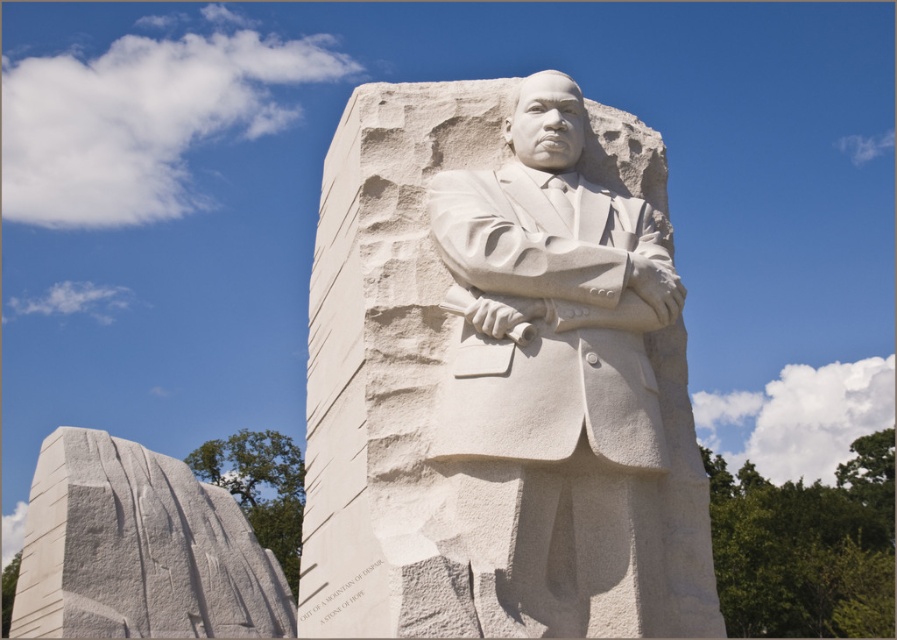
Question: Which point appears farthest from the camera in this image?

Choices:
 (A) (247, 548)
 (B) (601, 300)

Answer: (A)

Question: Which object is closer to the camera taking this photo?

Choices:
 (A) white marble stone at left
 (B) white marble statue at center

Answer: (B)

Question: Can you confirm if white marble statue at center is positioned to the right of white marble stone at left?

Choices:
 (A) no
 (B) yes

Answer: (B)

Question: Is white marble statue at center below white marble stone at left?

Choices:
 (A) no
 (B) yes

Answer: (A)

Question: Does white marble statue at center appear on the right side of white marble stone at left?

Choices:
 (A) no
 (B) yes

Answer: (B)

Question: Which point appears farthest from the camera in this image?

Choices:
 (A) (94, 506)
 (B) (590, 336)

Answer: (A)